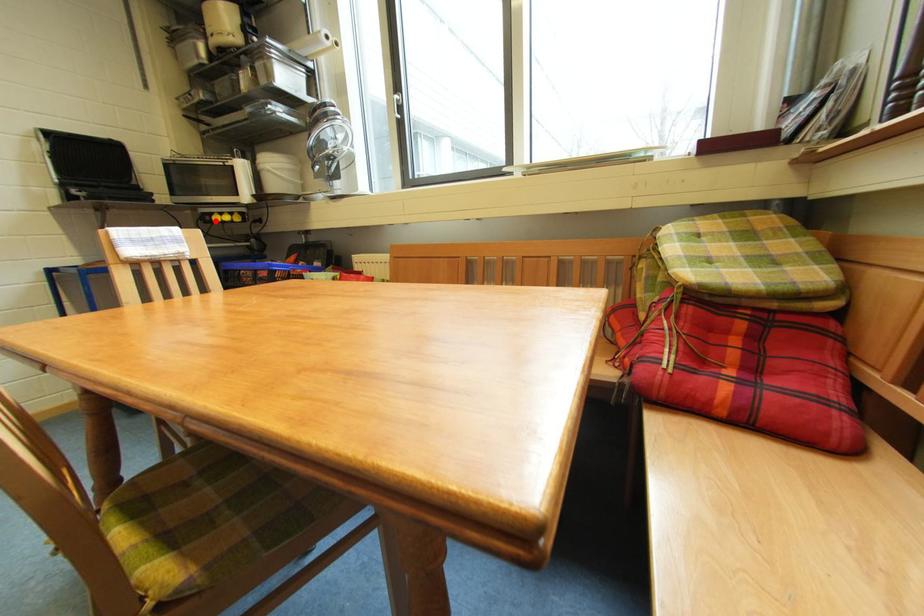
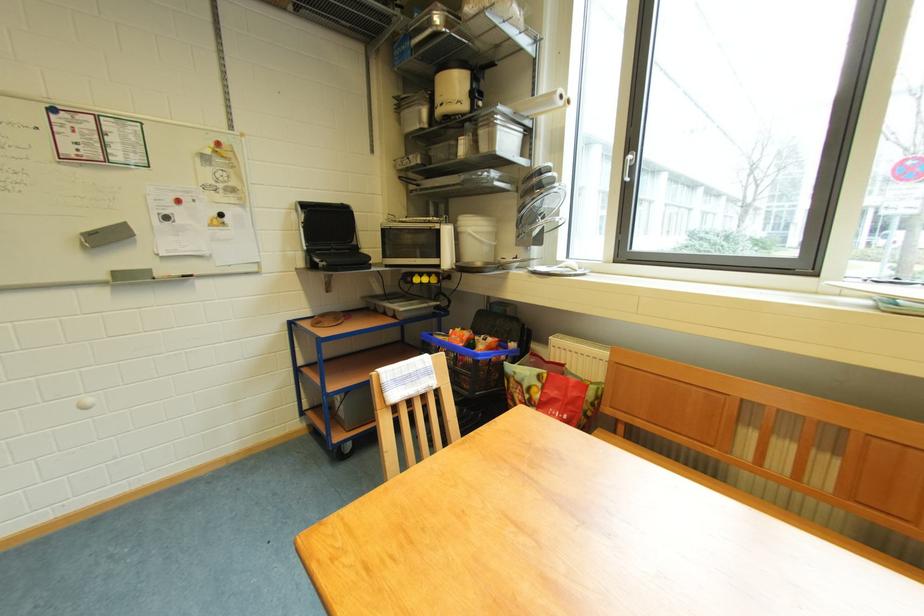
Where in the second image is the point corresponding to the highlighted location from the first image?

(417, 282)